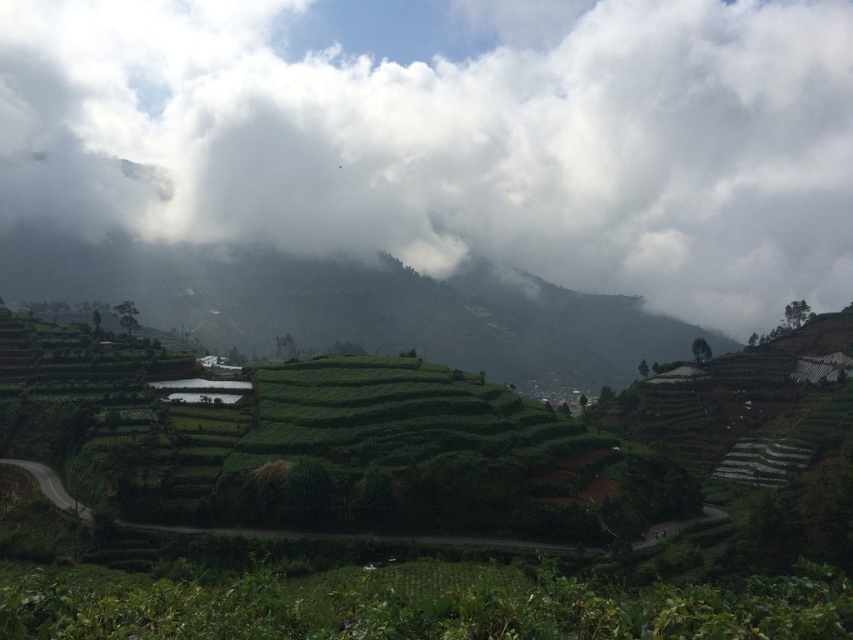
You are a photographer planning to capture the entire scene in one shot. Given that the white fluffy cloud at upper center and the green grassy hillside at center are both in your frame, which of these two objects would require a wider angle lens to fully capture in your photo?

The white fluffy cloud at upper center requires a wider angle lens because its width surpasses that of the green grassy hillside at center, meaning it occupies more space in the frame and needs a wider field of view to be fully captured.

You are a hiker standing at the bottom of the green grassy hillside at center and looking up. Which direction should you look to see the white fluffy cloud at upper center?

The white fluffy cloud at upper center is positioned on the right side of green grassy hillside at center, so you should look to the right to see it.